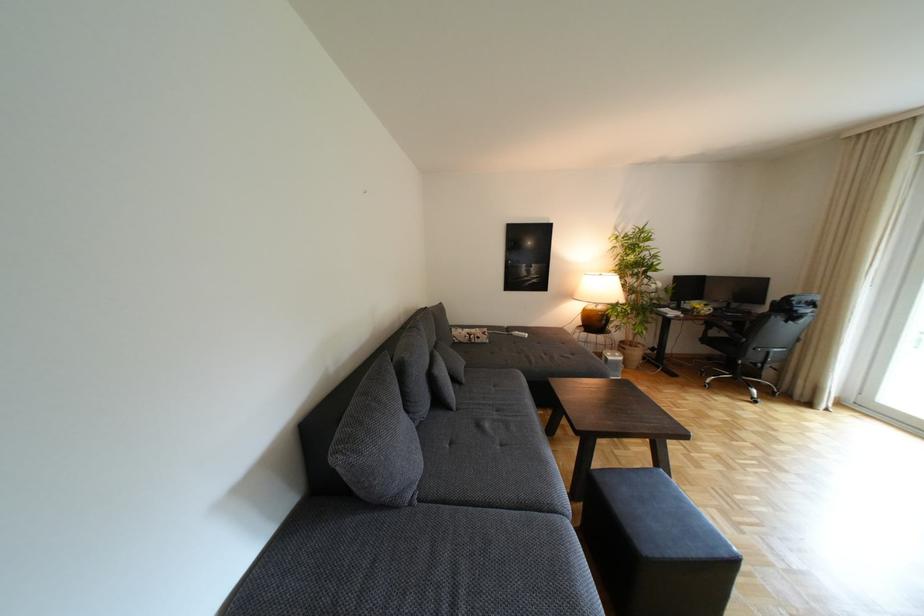
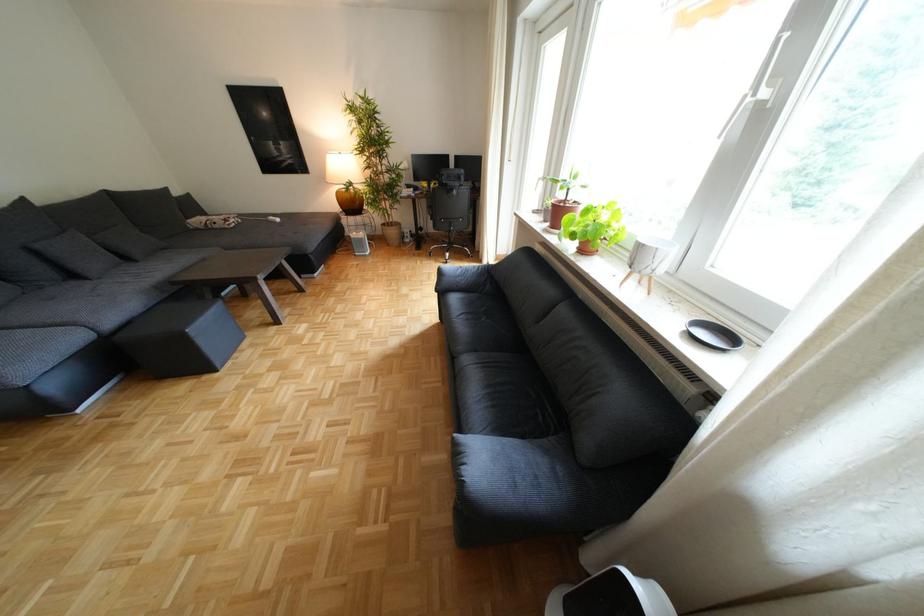
In the second image, find the point that corresponds to point 598,310 in the first image.

(351, 193)